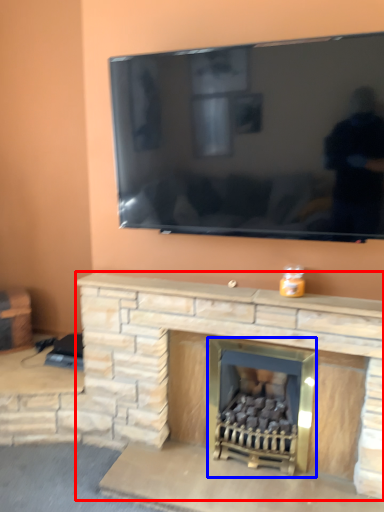
Question: Among these objects, which one is farthest to the camera, fireplace (highlighted by a red box) or fireplace (highlighted by a blue box)?

Choices:
 (A) fireplace
 (B) fireplace

Answer: (B)